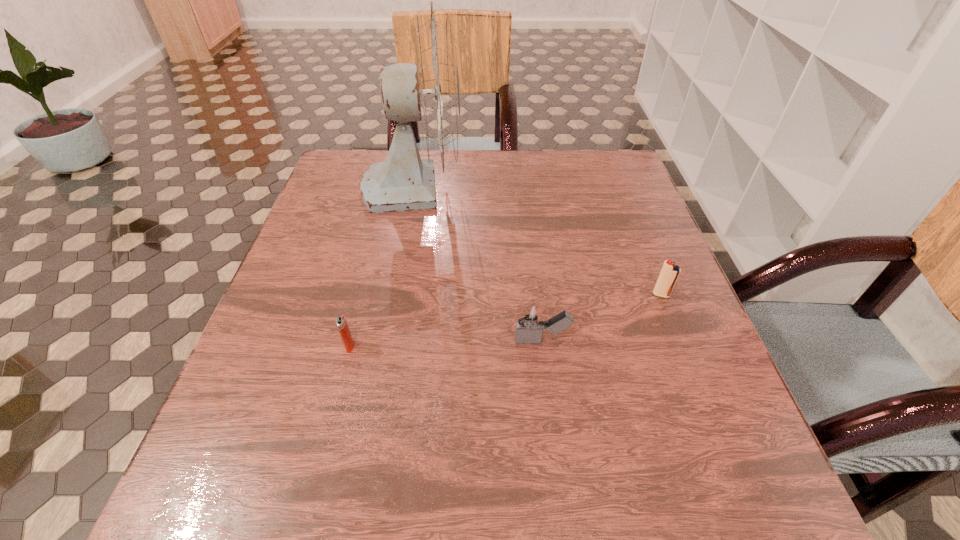
Identify the location of empty location between the leftmost igniter and the rightmost igniter. The width and height of the screenshot is (960, 540). tap(505, 321).

This screenshot has height=540, width=960. I want to click on empty space between the rightmost object and the fan, so click(x=538, y=240).

You are a GUI agent. You are given a task and a screenshot of the screen. Output one action in this format:
    pyautogui.click(x=<x>, y=<y>)
    Task: Click on the free area in between the rightmost object and the second igniter from left to right
    This screenshot has width=960, height=540.
    Given the screenshot: What is the action you would take?
    pyautogui.click(x=602, y=318)

Where is `blank region between the rightmost object and the tallest object`? blank region between the rightmost object and the tallest object is located at coordinates (538, 240).

Where is `unoccupied position between the third object from left to right and the leftmost igniter`? unoccupied position between the third object from left to right and the leftmost igniter is located at coordinates (445, 343).

Where is `empty space that is in between the leftmost igniter and the farthest object`? This screenshot has width=960, height=540. empty space that is in between the leftmost igniter and the farthest object is located at coordinates (381, 266).

Where is `free space that is in between the second igniter from left to right and the leftmost igniter`? free space that is in between the second igniter from left to right and the leftmost igniter is located at coordinates (445, 343).

Identify the location of vacant space in between the leftmost igniter and the farthest igniter. Image resolution: width=960 pixels, height=540 pixels. (505, 321).

Identify the location of vacant space in between the tallest object and the farthest igniter. The width and height of the screenshot is (960, 540). (538, 240).

Locate an element on the screen. vacant space in between the tallest object and the second object from right to left is located at coordinates (478, 263).